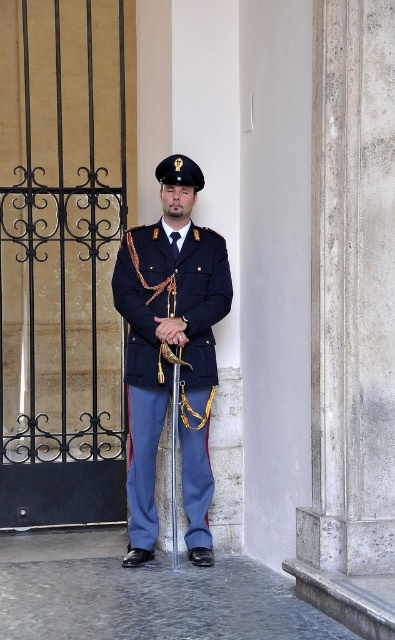
Question: Is black wrought iron gate at left bigger than metallic gold pole at center?

Choices:
 (A) no
 (B) yes

Answer: (B)

Question: Can you confirm if black wrought iron gate at left is thinner than metallic gold pole at center?

Choices:
 (A) yes
 (B) no

Answer: (B)

Question: Among these objects, which one is nearest to the camera?

Choices:
 (A) metallic gold pole at center
 (B) black wrought iron gate at left

Answer: (A)

Question: Is black wrought iron gate at left positioned at the back of navy blue fabric uniform at center?

Choices:
 (A) no
 (B) yes

Answer: (B)

Question: Which point is farther from the camera taking this photo?

Choices:
 (A) [58, 8]
 (B) [174, 474]

Answer: (A)

Question: Which is farther from the metallic gold pole at center?

Choices:
 (A) navy blue fabric uniform at center
 (B) black wrought iron gate at left

Answer: (B)